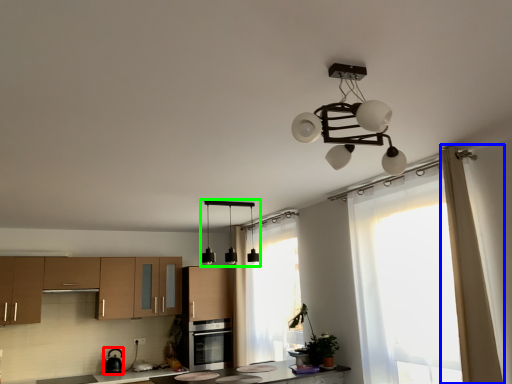
Question: Which object is the closest to the appliance (highlighted by a red box)? Choose among these: curtain (highlighted by a blue box) or lamp (highlighted by a green box).

Choices:
 (A) curtain
 (B) lamp

Answer: (B)